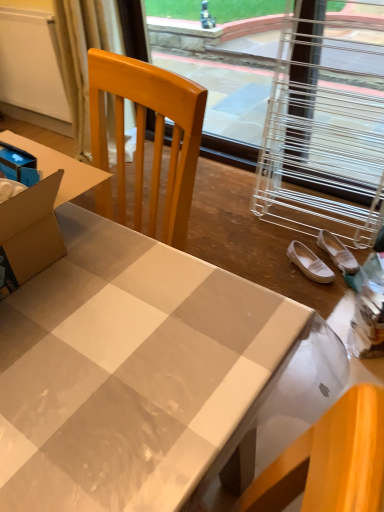
Question: In the image, is white fabric shoe at lower right, marked as the second footwear in a left-to-right arrangement, positioned in front of or behind metallic wire at upper right?

Choices:
 (A) behind
 (B) front

Answer: (A)

Question: Based on their positions, is white fabric shoe at lower right, marked as the second footwear in a left-to-right arrangement, located to the left or right of metallic wire at upper right?

Choices:
 (A) left
 (B) right

Answer: (B)

Question: Which of these objects is positioned closest to the white glossy desk at center?

Choices:
 (A) beige fabric curtain at upper left
 (B) white suede shoes at lower right, marked as the 1th footwear in a left-to-right arrangement
 (C) metallic wire at upper right
 (D) white fabric shoe at lower right, marked as the second footwear in a left-to-right arrangement

Answer: (B)

Question: Which is farther from the white fabric shoe at lower right, marked as the second footwear in a left-to-right arrangement?

Choices:
 (A) metallic wire at upper right
 (B) white glossy desk at center
 (C) beige fabric curtain at upper left
 (D) white suede shoes at lower right, marked as the 1th footwear in a left-to-right arrangement

Answer: (A)